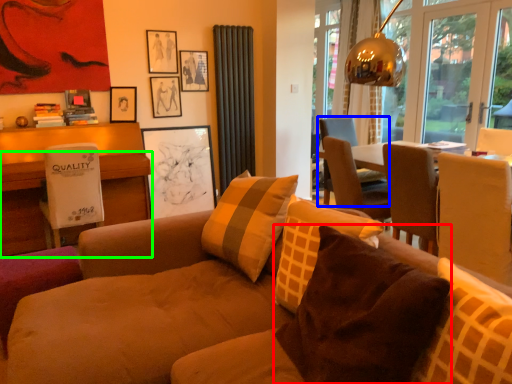
Question: Estimate the real-world distances between objects in this image. Which object is closer to pillow (highlighted by a red box), chair (highlighted by a blue box) or desk (highlighted by a green box)?

Choices:
 (A) chair
 (B) desk

Answer: (B)